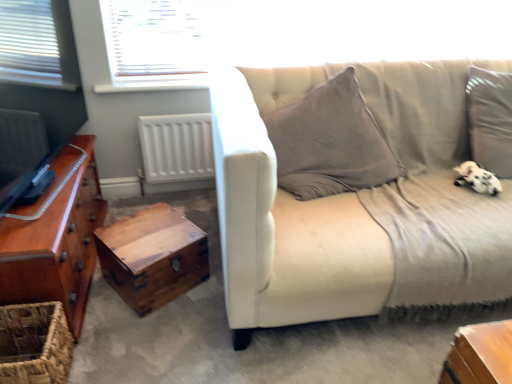
Question: From the image's perspective, does woven brown basket at lower left appear higher than white fluffy dog at lower right?

Choices:
 (A) yes
 (B) no

Answer: (B)

Question: Does woven brown basket at lower left have a greater width compared to white fluffy dog at lower right?

Choices:
 (A) yes
 (B) no

Answer: (A)

Question: Is white fluffy dog at lower right surrounded by woven brown basket at lower left?

Choices:
 (A) no
 (B) yes

Answer: (A)

Question: Is woven brown basket at lower left oriented towards white fluffy dog at lower right?

Choices:
 (A) no
 (B) yes

Answer: (B)

Question: Is woven brown basket at lower left not within white fluffy dog at lower right?

Choices:
 (A) no
 (B) yes

Answer: (B)

Question: From the image's perspective, is woven brown basket at lower left positioned above or below shiny brown wooden chest of drawers at left?

Choices:
 (A) below
 (B) above

Answer: (A)

Question: Considering the positions of woven brown basket at lower left and shiny brown wooden chest of drawers at left in the image, is woven brown basket at lower left taller or shorter than shiny brown wooden chest of drawers at left?

Choices:
 (A) short
 (B) tall

Answer: (A)

Question: Do you think woven brown basket at lower left is within shiny brown wooden chest of drawers at left, or outside of it?

Choices:
 (A) inside
 (B) outside

Answer: (B)

Question: Is point (53, 372) closer or farther from the camera than point (93, 150)?

Choices:
 (A) farther
 (B) closer

Answer: (B)

Question: In terms of height, does wooden chest at lower left look taller or shorter compared to woven brown basket at lower left?

Choices:
 (A) tall
 (B) short

Answer: (B)

Question: Relative to woven brown basket at lower left, is wooden chest at lower left in front or behind?

Choices:
 (A) front
 (B) behind

Answer: (B)

Question: From a real-world perspective, relative to woven brown basket at lower left, is wooden chest at lower left vertically above or below?

Choices:
 (A) above
 (B) below

Answer: (B)

Question: Which is correct: wooden chest at lower left is inside woven brown basket at lower left, or outside of it?

Choices:
 (A) outside
 (B) inside

Answer: (A)

Question: Is white fluffy dog at lower right wider or thinner than wooden chest at lower left?

Choices:
 (A) wide
 (B) thin

Answer: (B)

Question: Visually, is white fluffy dog at lower right positioned to the left or to the right of wooden chest at lower left?

Choices:
 (A) left
 (B) right

Answer: (B)